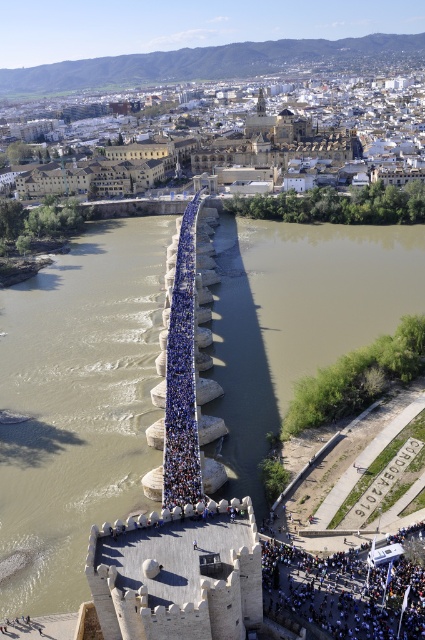
You are standing on the Roman Bridge of Cordoba and looking at the two points marked on the bridge. The first point is at coordinates point (130, 234) and the second point is at point (336, 604). Which point is closer to you?

Point (130, 234) is closer to you because it is further to the camera than point (336, 604).

You are a photographer planning to take a photo of the brown sedimentary stone bridge at center and the blue fabric crowd at center. Which object should you focus on first if you want to capture both in a single shot without adjusting your camera settings? Explain your reasoning based on their relative sizes in the scene.

The brown sedimentary stone bridge at center is much taller than the blue fabric crowd at center. Therefore, to ensure both are in focus, you should focus on the brown sedimentary stone bridge at center first since it is larger and occupies more of the frame, making it easier to achieve proper focus and exposure.

You are a drone operator tasked with capturing aerial footage of the Roman Bridge of Cordoba. Your drone has a maximum flight range of 30 meters. You need to fly from the brown sedimentary stone bridge at center to the brown muddy water at center. Can your drone complete this flight without exceeding its range?

The brown sedimentary stone bridge at center and brown muddy water at center are 32.85 meters apart from each other. Since the drone has a maximum flight range of 30 meters, it cannot complete the flight without exceeding its range.